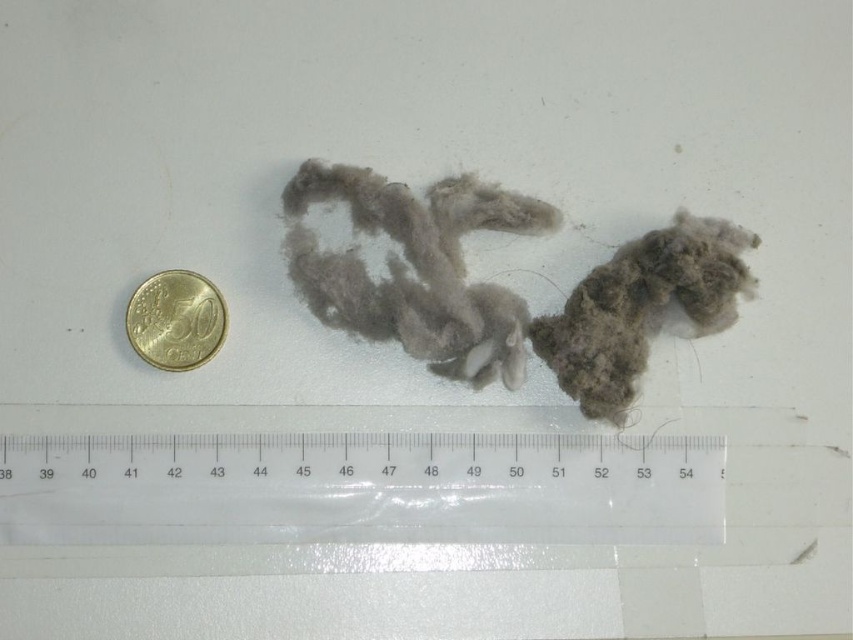
Does transparent plastic ruler at lower center have a larger size compared to gold metallic coin at left?

Correct, transparent plastic ruler at lower center is larger in size than gold metallic coin at left.

Who is positioned more to the right, transparent plastic ruler at lower center or gold metallic coin at left?

transparent plastic ruler at lower center

Measure the distance between transparent plastic ruler at lower center and camera.

transparent plastic ruler at lower center is 4.34 feet away from camera.

This screenshot has width=853, height=640. I want to click on transparent plastic ruler at lower center, so click(x=360, y=488).

Is transparent plastic ruler at lower center positioned in front of fuzzy gray fur at right?

Yes, transparent plastic ruler at lower center is in front of fuzzy gray fur at right.

Between transparent plastic ruler at lower center and fuzzy gray fur at right, which one has more height?

fuzzy gray fur at right

Is point (488, 435) closer to viewer compared to point (639, 273)?

That is False.

Identify the location of transparent plastic ruler at lower center. (360, 488).

Who is more distant from viewer, (283, 189) or (610, 362)?

The point (283, 189) is more distant.

Where is `fuzzy gray fur at center`? The height and width of the screenshot is (640, 853). fuzzy gray fur at center is located at coordinates (415, 268).